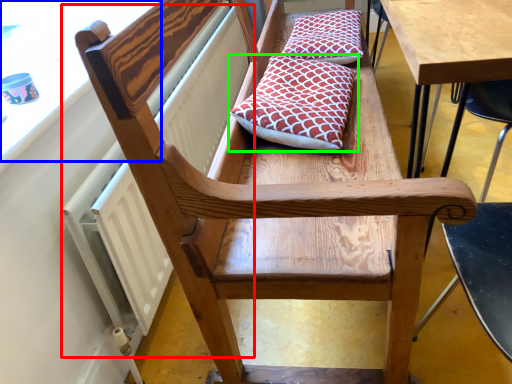
Question: Which object is positioned closest to radiator (highlighted by a red box)? Select from window screen (highlighted by a blue box) and pillow (highlighted by a green box).

Choices:
 (A) window screen
 (B) pillow

Answer: (A)